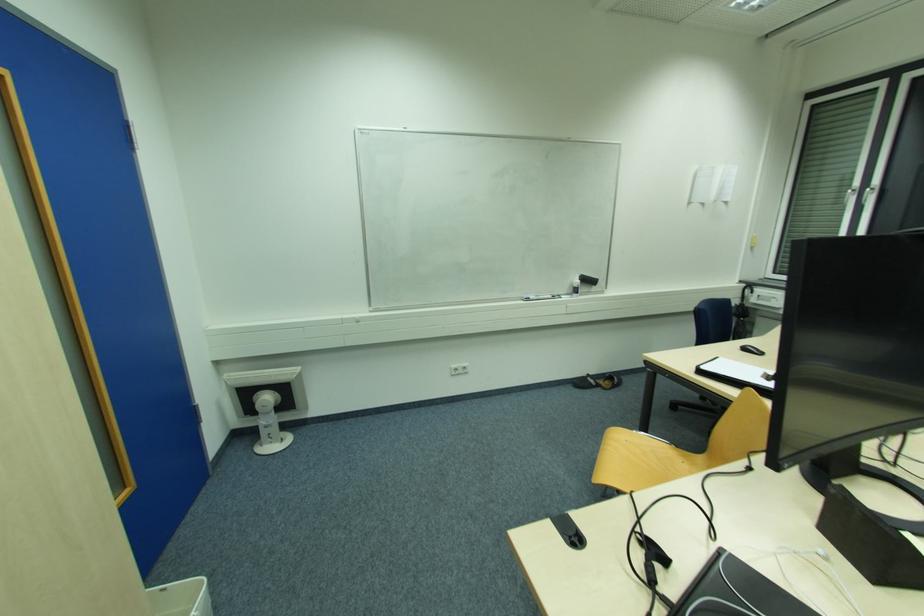
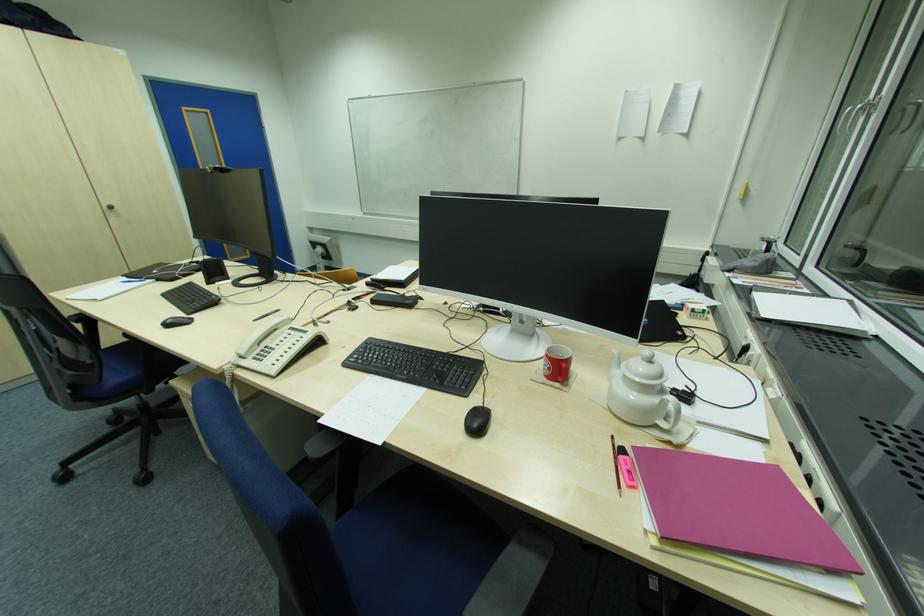
In the second image, find the point that corresponds to point 852,191 in the first image.

(850, 111)